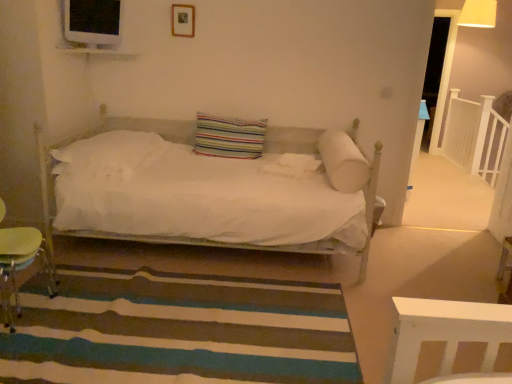
Question: Does white wooden balustrade at upper right have a greater width compared to striped carpet at lower center?

Choices:
 (A) no
 (B) yes

Answer: (A)

Question: From a real-world perspective, is white wooden balustrade at upper right over striped carpet at lower center?

Choices:
 (A) no
 (B) yes

Answer: (B)

Question: Is white wooden balustrade at upper right with striped carpet at lower center?

Choices:
 (A) no
 (B) yes

Answer: (A)

Question: From the image's perspective, is white wooden balustrade at upper right located beneath striped carpet at lower center?

Choices:
 (A) yes
 (B) no

Answer: (B)

Question: Would you say white wooden balustrade at upper right contains striped carpet at lower center?

Choices:
 (A) no
 (B) yes

Answer: (A)

Question: From a real-world perspective, is white wooden balustrade at upper right located beneath striped carpet at lower center?

Choices:
 (A) yes
 (B) no

Answer: (B)

Question: From the image's perspective, is wooden picture frame at upper center under striped carpet at lower center?

Choices:
 (A) no
 (B) yes

Answer: (A)

Question: Is wooden picture frame at upper center not inside striped carpet at lower center?

Choices:
 (A) yes
 (B) no

Answer: (A)

Question: Considering the relative sizes of wooden picture frame at upper center and striped carpet at lower center in the image provided, is wooden picture frame at upper center shorter than striped carpet at lower center?

Choices:
 (A) yes
 (B) no

Answer: (B)

Question: From a real-world perspective, is wooden picture frame at upper center positioned under striped carpet at lower center based on gravity?

Choices:
 (A) yes
 (B) no

Answer: (B)

Question: From a real-world perspective, is wooden picture frame at upper center on striped carpet at lower center?

Choices:
 (A) no
 (B) yes

Answer: (B)

Question: Does wooden picture frame at upper center have a greater height compared to striped carpet at lower center?

Choices:
 (A) yes
 (B) no

Answer: (A)

Question: Considering the relative sizes of striped fabric pillow at center, placed as the 2th pillow when sorted from left to right, and wooden lampshade at upper right in the image provided, is striped fabric pillow at center, placed as the 2th pillow when sorted from left to right, thinner than wooden lampshade at upper right?

Choices:
 (A) no
 (B) yes

Answer: (B)